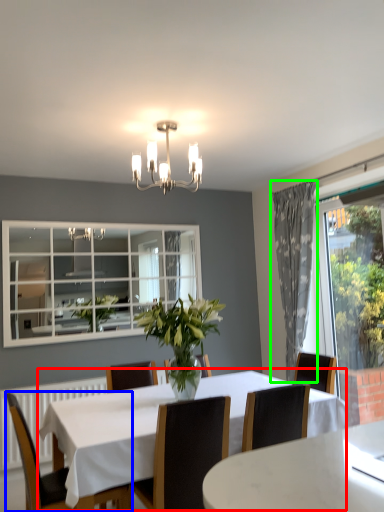
Question: Which is nearer to the kitchen & dining room table (highlighted by a red box)? chair (highlighted by a blue box) or curtain (highlighted by a green box).

Choices:
 (A) chair
 (B) curtain

Answer: (A)